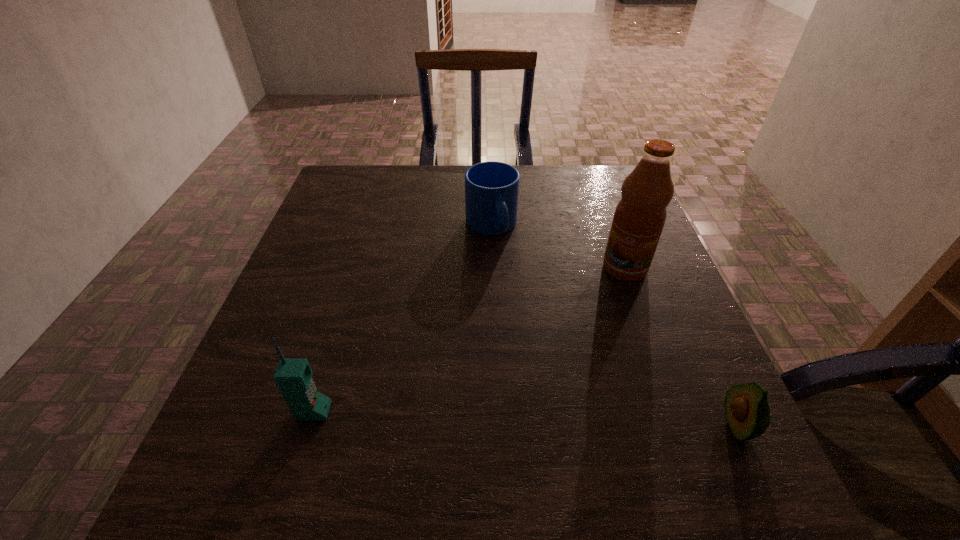
Locate an element on the screen. vacant space on the desktop that is between the third shortest object and the avocado and is positioned on the label side of the second object from right to left is located at coordinates (517, 418).

The height and width of the screenshot is (540, 960). I want to click on vacant space on the desktop that is between the cellular telephone and the rightmost object and is positioned on the side of the third object from right to left with the handle, so click(x=584, y=421).